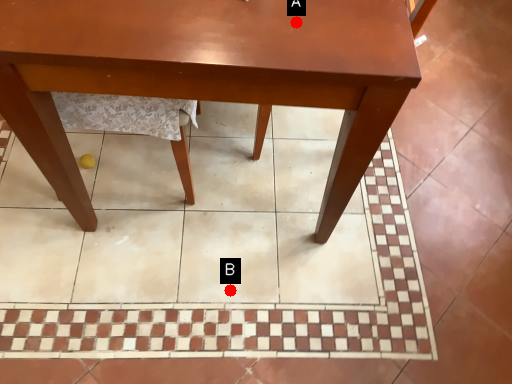
Question: Two points are circled on the image, labeled by A and B beside each circle. Which point appears closest to the camera in this image?

Choices:
 (A) A is closer
 (B) B is closer

Answer: (A)